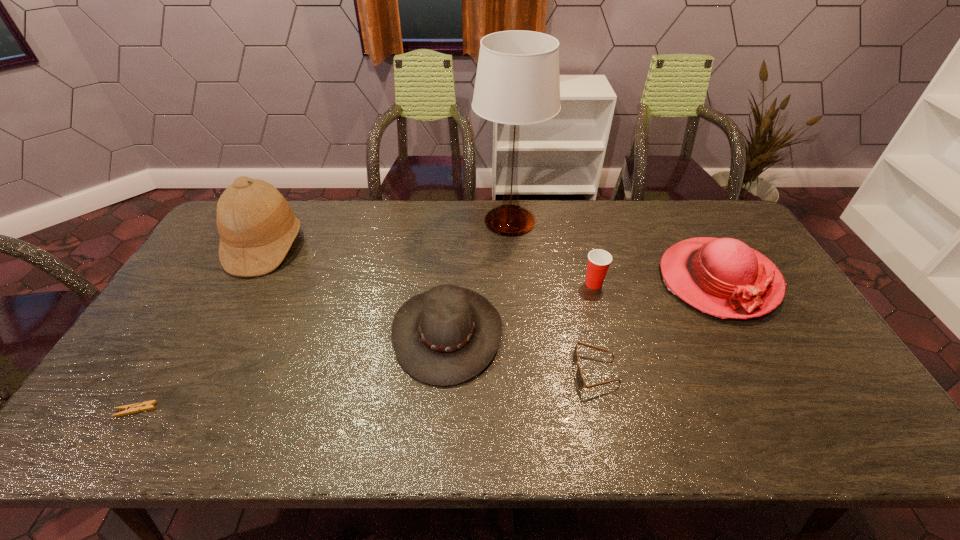
This screenshot has height=540, width=960. In order to click on table lamp in this screenshot , I will do `click(517, 82)`.

You are a GUI agent. You are given a task and a screenshot of the screen. Output one action in this format:
    pyautogui.click(x=<x>, y=<y>)
    Task: Click on the second tallest object
    The width and height of the screenshot is (960, 540).
    Given the screenshot: What is the action you would take?
    pyautogui.click(x=257, y=227)

The height and width of the screenshot is (540, 960). In order to click on the leftmost hat in this screenshot , I will do `click(257, 227)`.

Locate an element on the screen. the rightmost object is located at coordinates (723, 277).

The image size is (960, 540). What are the coordinates of `the second hat from left to right` in the screenshot? It's located at (445, 336).

At what (x,y) coordinates should I click in order to perform the action: click on Dixie cup. Please return your answer as a coordinate pair (x, y). The width and height of the screenshot is (960, 540). Looking at the image, I should click on (599, 260).

Locate an element on the screen. The image size is (960, 540). the second shortest object is located at coordinates pyautogui.click(x=580, y=381).

Locate an element on the screen. The image size is (960, 540). the shortest object is located at coordinates (148, 405).

You are a GUI agent. You are given a task and a screenshot of the screen. Output one action in this format:
    pyautogui.click(x=<x>, y=<y>)
    Task: Click on the clothespin
    This screenshot has width=960, height=540.
    Given the screenshot: What is the action you would take?
    pyautogui.click(x=148, y=405)

In order to click on free space located 0.380m above the cylindrical shade of the tallest object in this screenshot , I will do `click(366, 221)`.